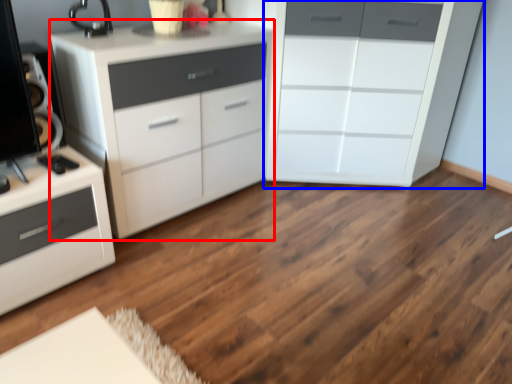
Question: Which object appears closest to the camera in this image, chest of drawers (highlighted by a red box) or chest of drawers (highlighted by a blue box)?

Choices:
 (A) chest of drawers
 (B) chest of drawers

Answer: (A)